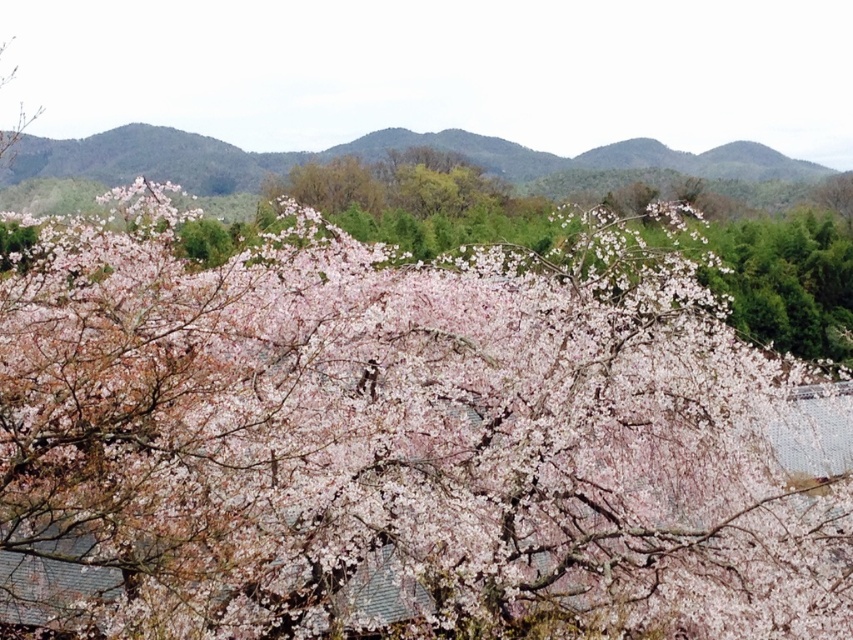
Describe the element at coordinates (403, 440) in the screenshot. I see `pink matte blossoms at center` at that location.

Is point (780, 540) closer to camera compared to point (277, 172)?

Yes, it is in front of point (277, 172).

This screenshot has height=640, width=853. I want to click on pink matte blossoms at center, so click(x=403, y=440).